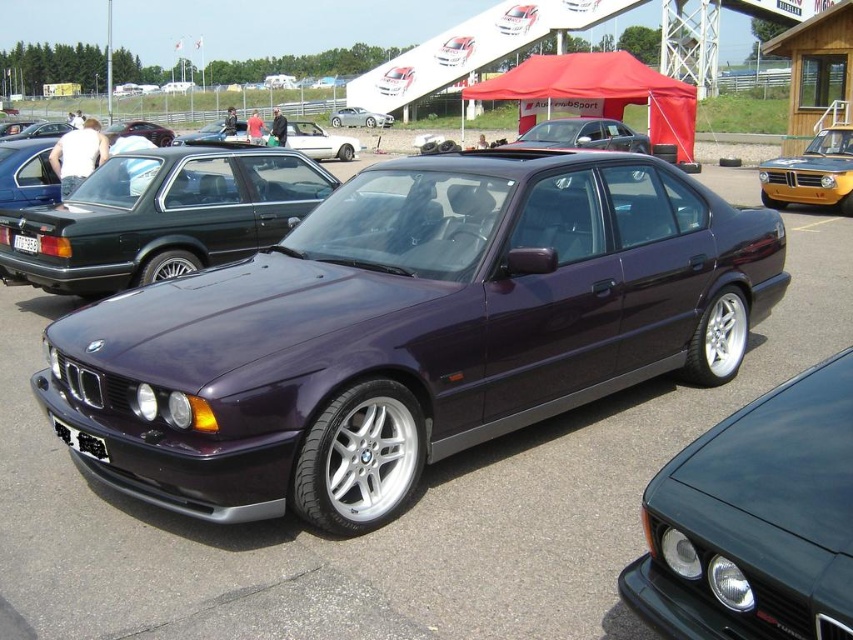
Between point (33, 209) and point (340, 124), which one is positioned in front?

Point (33, 209) is in front.

Which is more to the right, purple metallic sedan at center or satin silver sedan at center?

purple metallic sedan at center is more to the right.

Locate an element on the screen. purple metallic sedan at center is located at coordinates (161, 216).

The image size is (853, 640). What are the coordinates of `purple metallic sedan at center` in the screenshot? It's located at (161, 216).

Can you confirm if purple metallic car at center is bigger than glossy black car at lower right?

Correct, purple metallic car at center is larger in size than glossy black car at lower right.

From the picture: Who is more distant from viewer, (468, 358) or (671, 588)?

Point (468, 358)

The height and width of the screenshot is (640, 853). In order to click on purple metallic car at center in this screenshot , I will do `click(410, 330)`.

Between purple metallic sedan at center and metallic yellow car at right, which one is positioned lower?

purple metallic sedan at center is below.

Who is more forward, (x=241, y=224) or (x=770, y=176)?

Point (x=241, y=224)

Between point (270, 209) and point (846, 140), which one is positioned in front?

Positioned in front is point (270, 209).

Image resolution: width=853 pixels, height=640 pixels. I want to click on purple metallic sedan at center, so click(x=161, y=216).